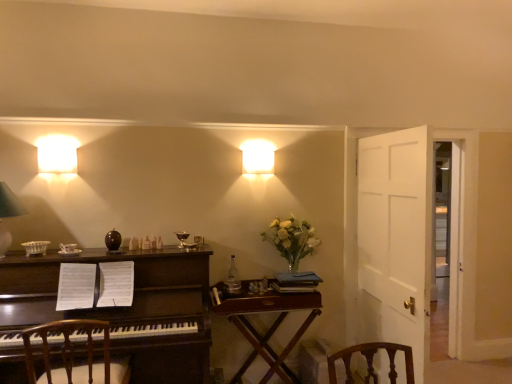
You are a GUI agent. You are given a task and a screenshot of the screen. Output one action in this format:
    pyautogui.click(x=<x>, y=<y>)
    Task: Click on the empty space that is ontop of matte white square at upper center, positioned as the first lamp in top-to-bottom order (from a real-world perspective)
    
    Given the screenshot: What is the action you would take?
    pyautogui.click(x=256, y=152)